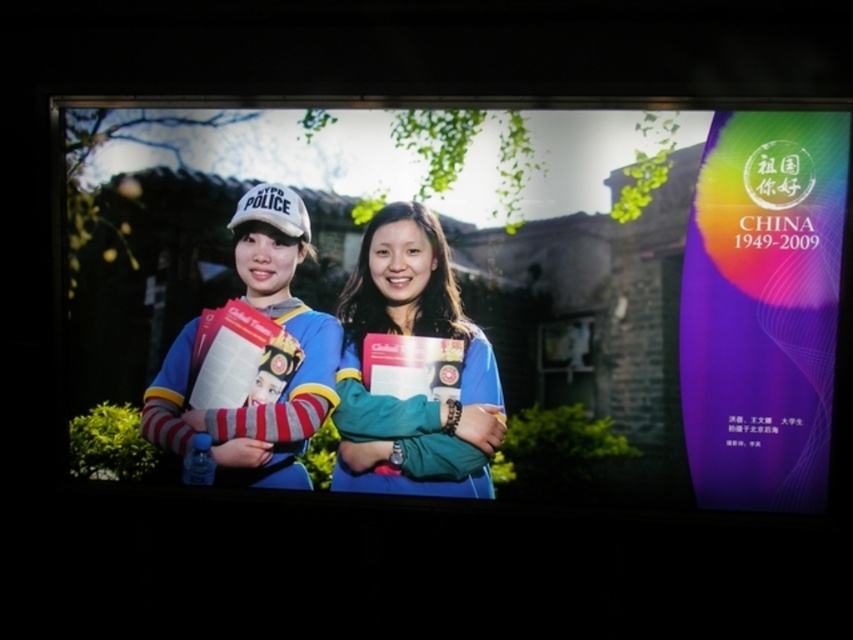
Can you confirm if blue fabric jacket at center is thinner than matte blue jacket at center?

Correct, blue fabric jacket at center's width is less than matte blue jacket at center's.

Does point (408, 472) lie in front of point (242, 477)?

Yes, it is.

Image resolution: width=853 pixels, height=640 pixels. In order to click on blue fabric jacket at center in this screenshot , I will do `click(415, 374)`.